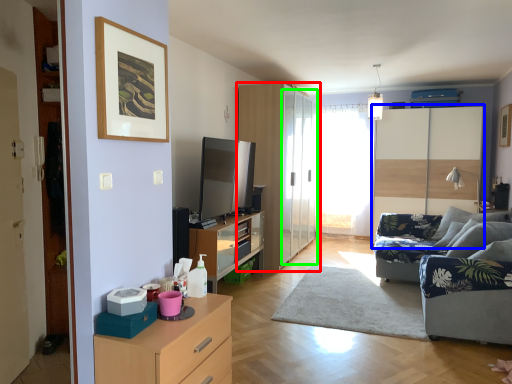
Question: Which object is positioned closest to cupboard (highlighted by a red box)? Select from dresser (highlighted by a blue box) and glass door (highlighted by a green box).

Choices:
 (A) dresser
 (B) glass door

Answer: (B)